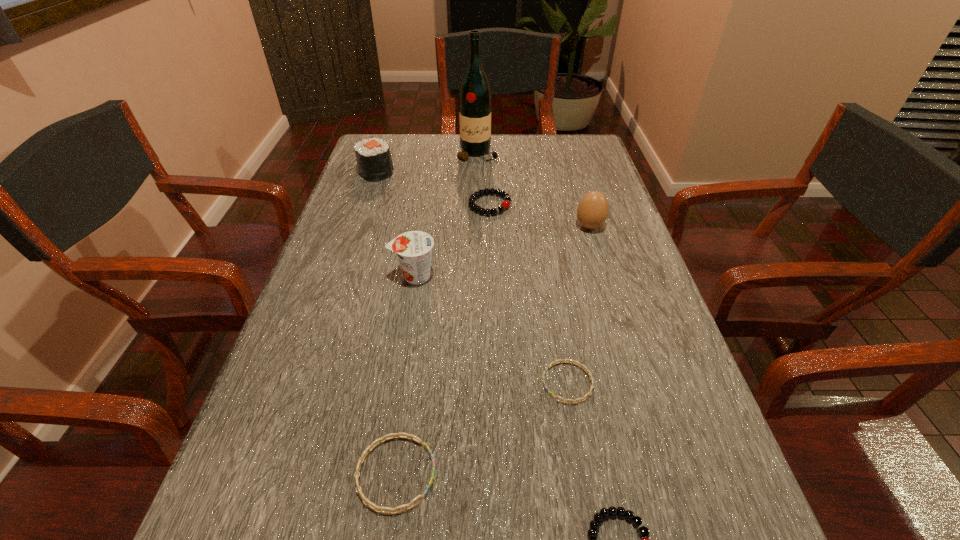
The height and width of the screenshot is (540, 960). I want to click on the farthest object, so click(475, 95).

Image resolution: width=960 pixels, height=540 pixels. In order to click on green wine bottle in this screenshot , I will do `click(475, 95)`.

Where is `brown boiled egg`? The width and height of the screenshot is (960, 540). brown boiled egg is located at coordinates (592, 211).

Where is `boiled egg`? The width and height of the screenshot is (960, 540). boiled egg is located at coordinates (592, 211).

Find the location of a particular element. The height and width of the screenshot is (540, 960). sushi is located at coordinates (373, 156).

The width and height of the screenshot is (960, 540). I want to click on the second farthest object, so click(x=373, y=156).

The height and width of the screenshot is (540, 960). I want to click on the fourth nearest object, so click(414, 248).

This screenshot has width=960, height=540. Identify the location of the farther black bracelet. (504, 205).

In order to click on the farthest bracelet in this screenshot , I will do `click(504, 205)`.

At what (x,y) coordinates should I click in order to perform the action: click on the nearer blue bracelet. Please return your answer as a coordinate pair (x, y). The height and width of the screenshot is (540, 960). Looking at the image, I should click on (395, 435).